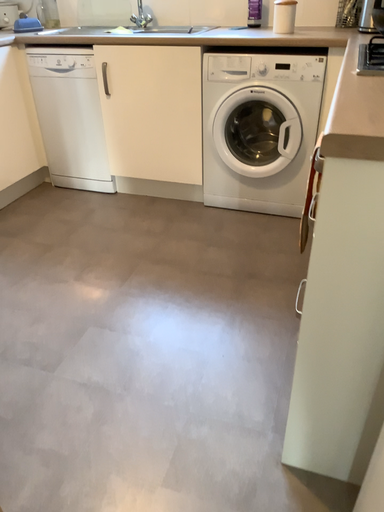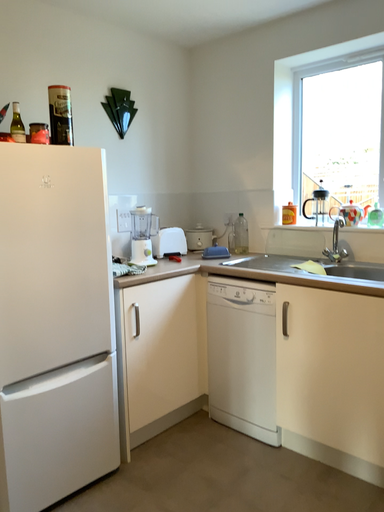
Question: Which way did the camera rotate in the video?

Choices:
 (A) rotated downward
 (B) rotated upward

Answer: (B)